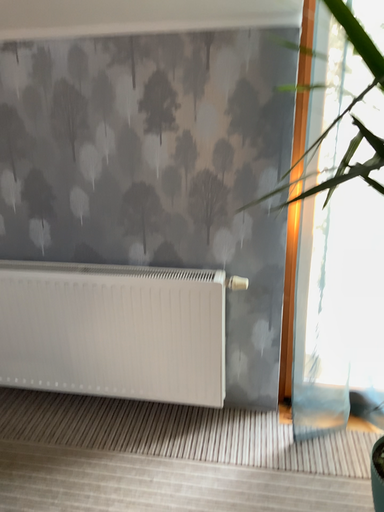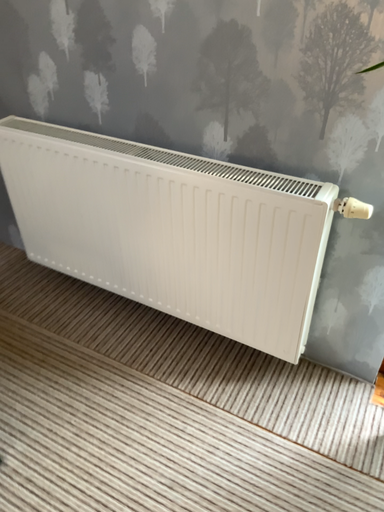
Question: Which way did the camera rotate in the video?

Choices:
 (A) rotated right
 (B) rotated left

Answer: (B)